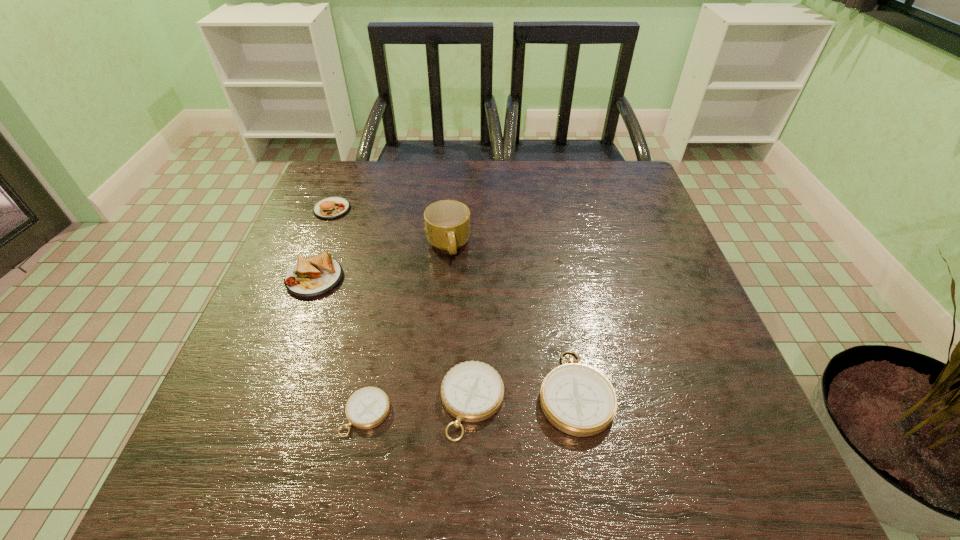
Please show where to add a compass on the right while keeping spacing even. Please provide its 2D coordinates. Your answer should be formatted as a tuple, i.e. [(x, y)], where the tuple contains the x and y coordinates of a point satisfying the conditions above.

[(673, 381)]